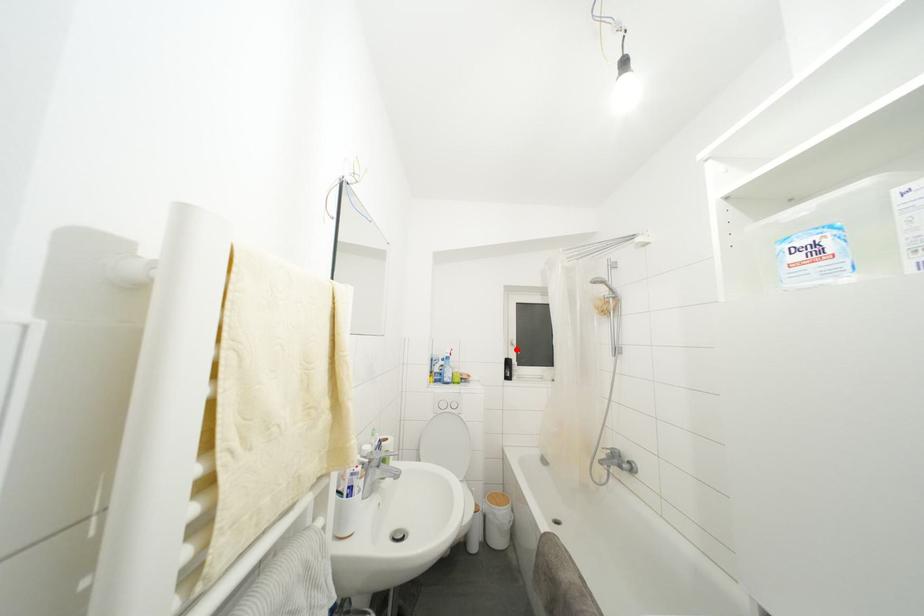
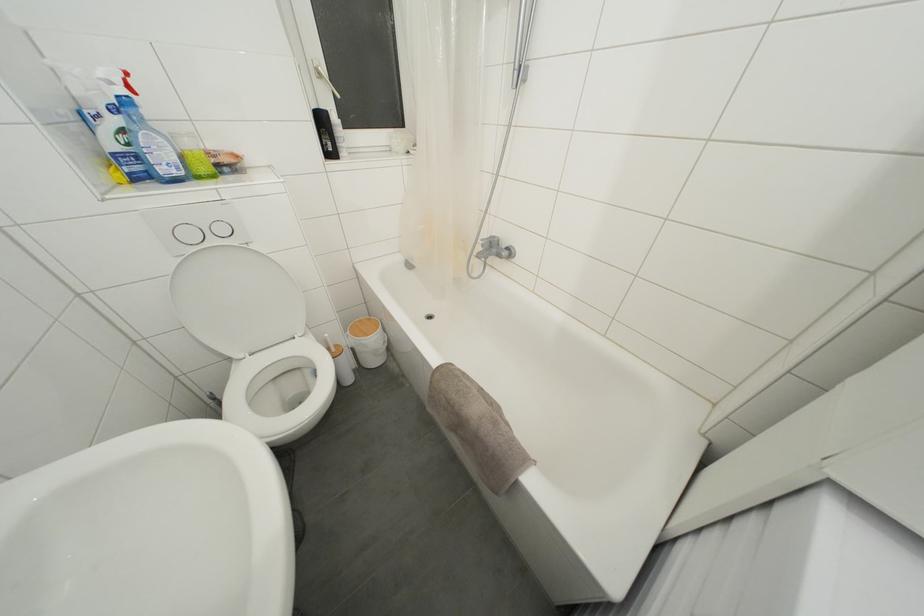
Locate, in the second image, the point that corresponds to the highlighted location in the first image.

(323, 79)